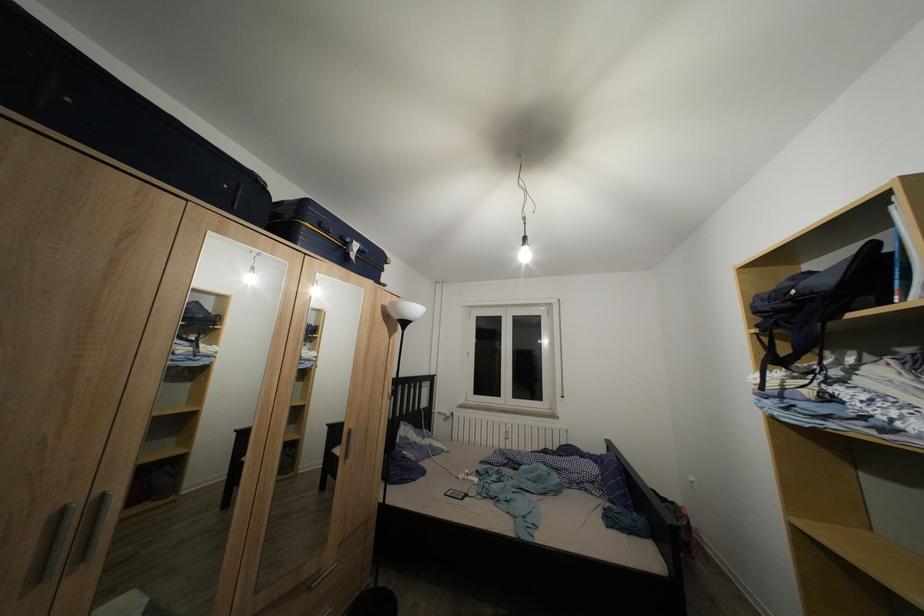
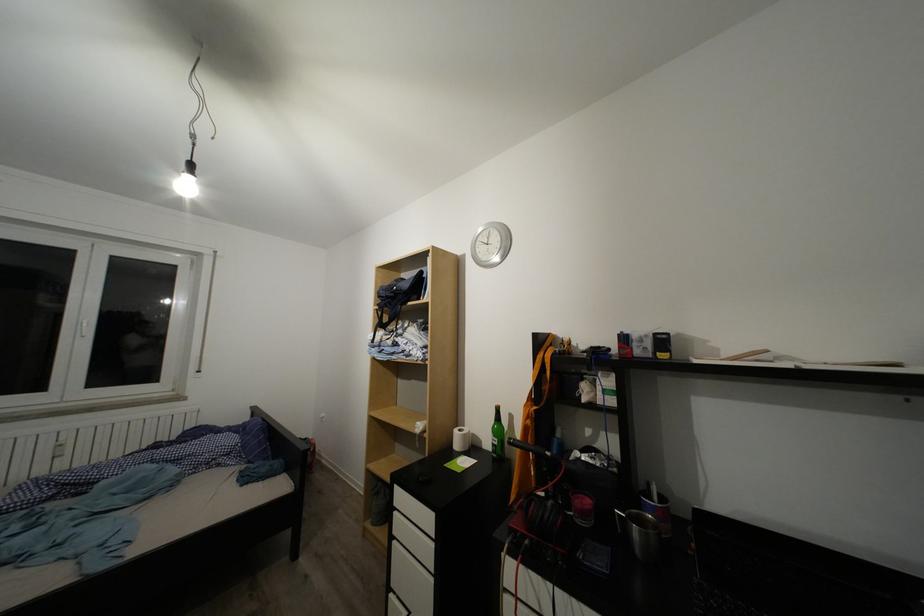
Where in the second image is the point corresponding to the point at 516,362 from the first image?

(90, 325)